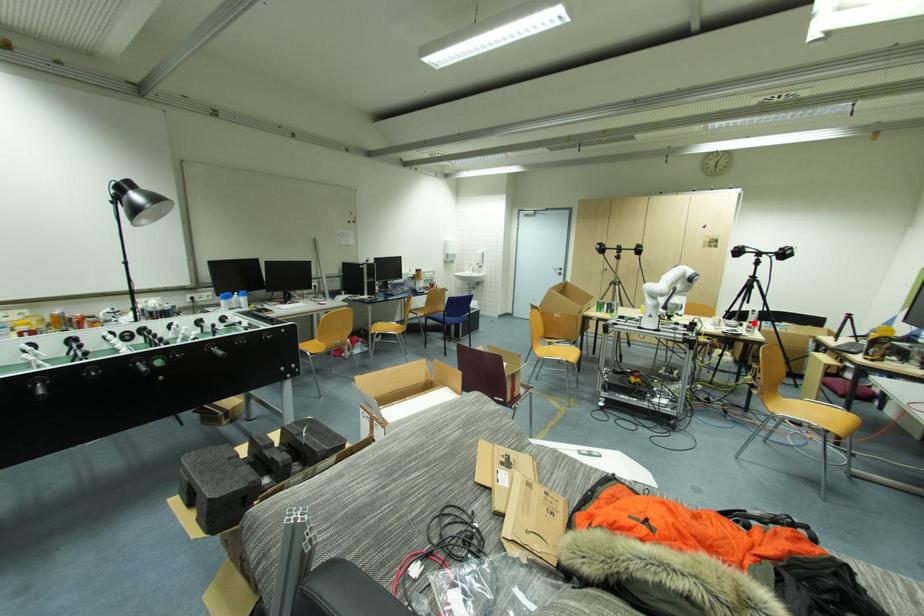
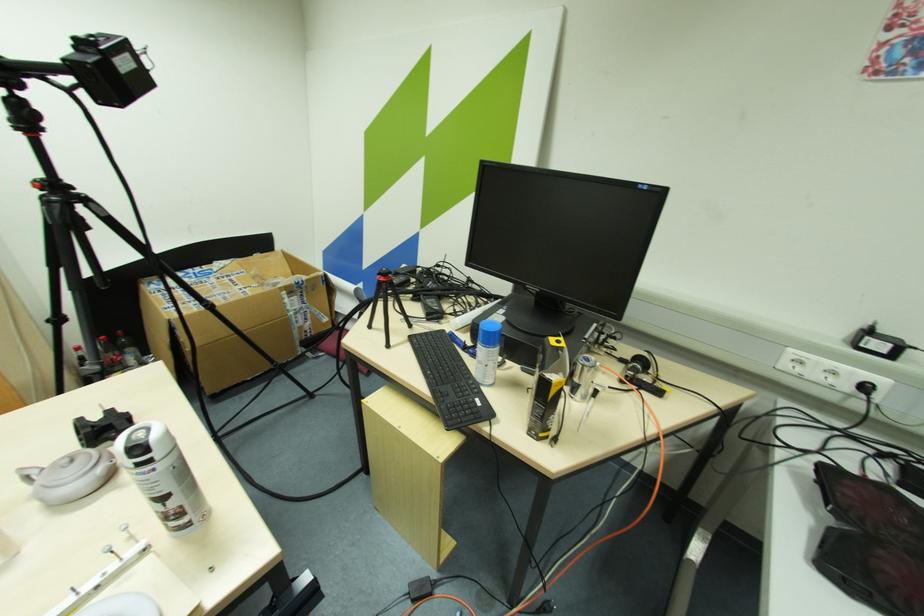
Locate, in the second image, the point that corresponds to the highlighted location in the first image.

(164, 500)